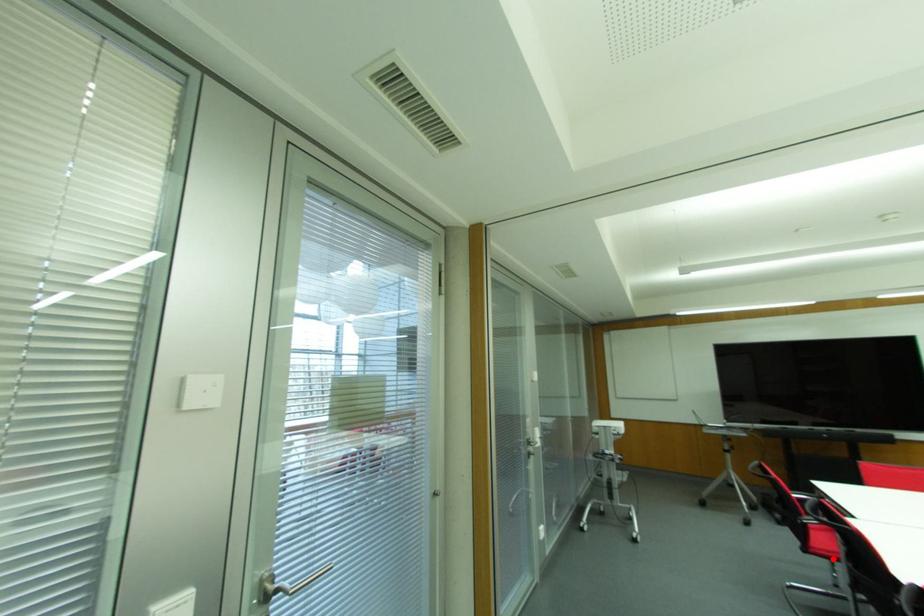
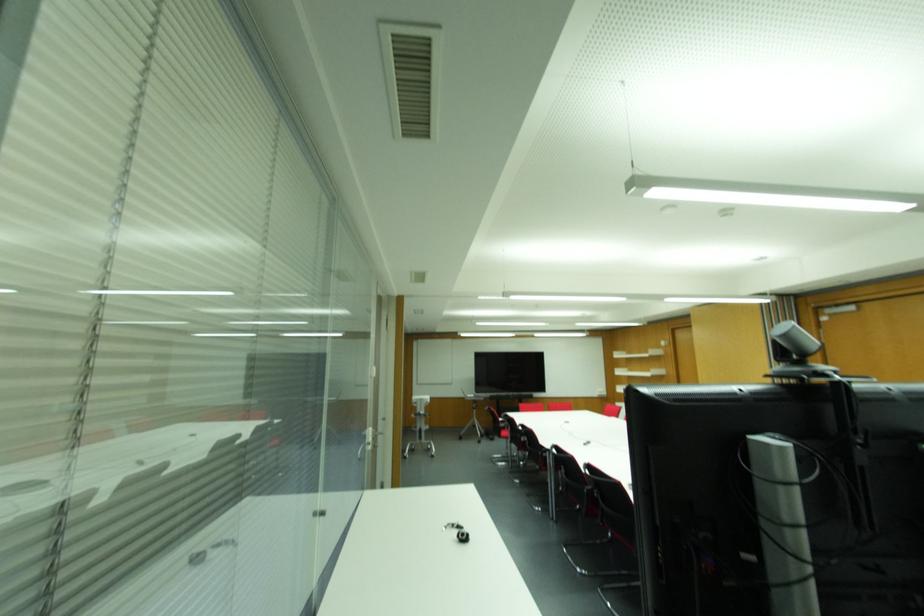
Where in the second image is the point corresponding to the highlighted location from the first image?

(505, 438)